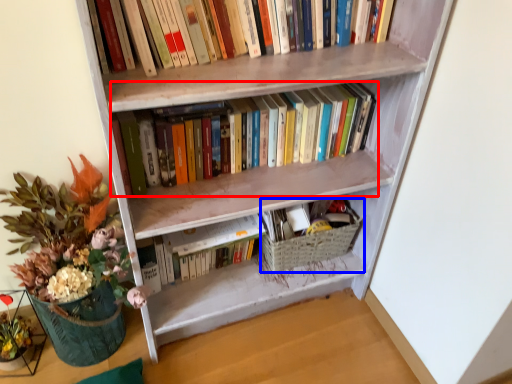
Question: Which point is further to the camera, book (highlighted by a red box) or basket (highlighted by a blue box)?

Choices:
 (A) book
 (B) basket

Answer: (B)